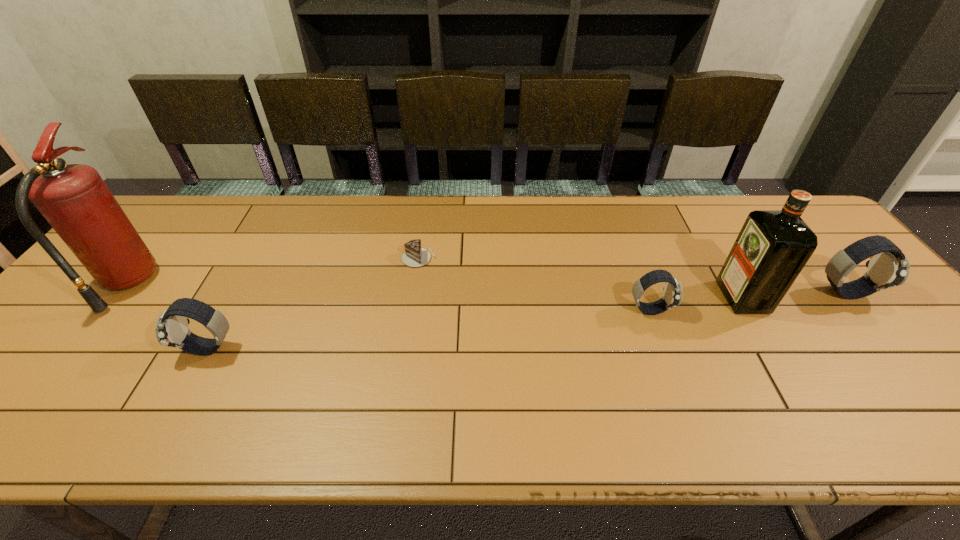
What are the coordinates of `object at the left edge` in the screenshot? It's located at (74, 199).

The width and height of the screenshot is (960, 540). In order to click on object that is at the right edge in this screenshot , I will do `click(888, 267)`.

This screenshot has width=960, height=540. In the image, there is a desktop. Find the location of `vacant area at the far edge`. vacant area at the far edge is located at coordinates (334, 228).

In the image, there is a desktop. Where is `vacant area at the near edge`? Image resolution: width=960 pixels, height=540 pixels. vacant area at the near edge is located at coordinates (478, 394).

The height and width of the screenshot is (540, 960). I want to click on vacant area at the right edge of the desktop, so click(892, 316).

At what (x,y) coordinates should I click in order to perform the action: click on vacant position at the near left corner of the desktop. Please return your answer as a coordinate pair (x, y). Looking at the image, I should click on (28, 377).

The width and height of the screenshot is (960, 540). Find the location of `vacant space at the far right corner of the desktop`. vacant space at the far right corner of the desktop is located at coordinates (762, 195).

At what (x,y) coordinates should I click in order to perform the action: click on free spot between the second tallest watch and the third object from right to left. Please return your answer as a coordinate pair (x, y). The image size is (960, 540). Looking at the image, I should click on (429, 329).

Find the location of `free space between the shortest object and the tallest object`. free space between the shortest object and the tallest object is located at coordinates (273, 271).

Image resolution: width=960 pixels, height=540 pixels. In order to click on free space between the chocolate cake and the second watch from left to right in this screenshot , I will do `click(534, 284)`.